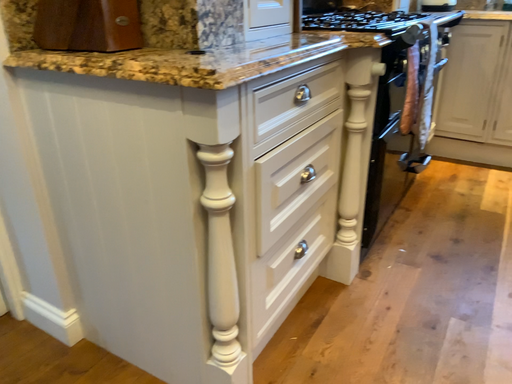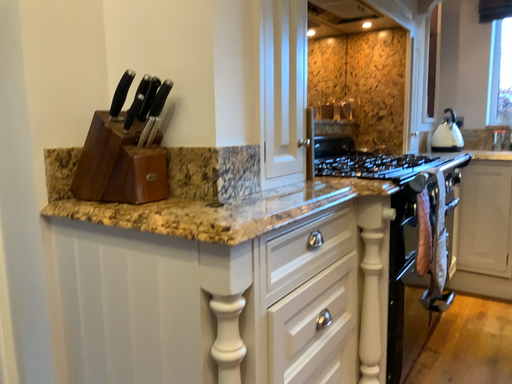
Question: How did the camera likely rotate when shooting the video?

Choices:
 (A) rotated downward
 (B) rotated upward

Answer: (B)